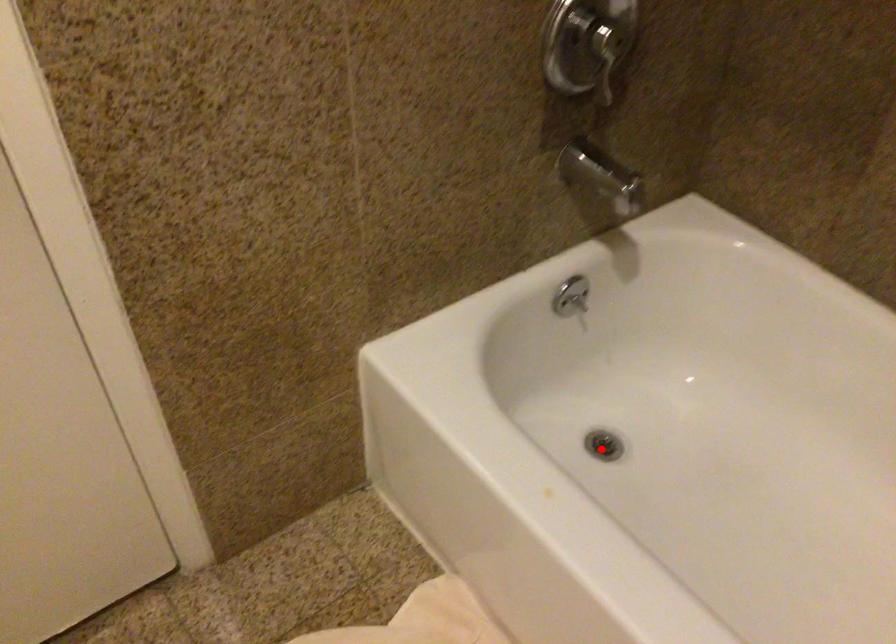
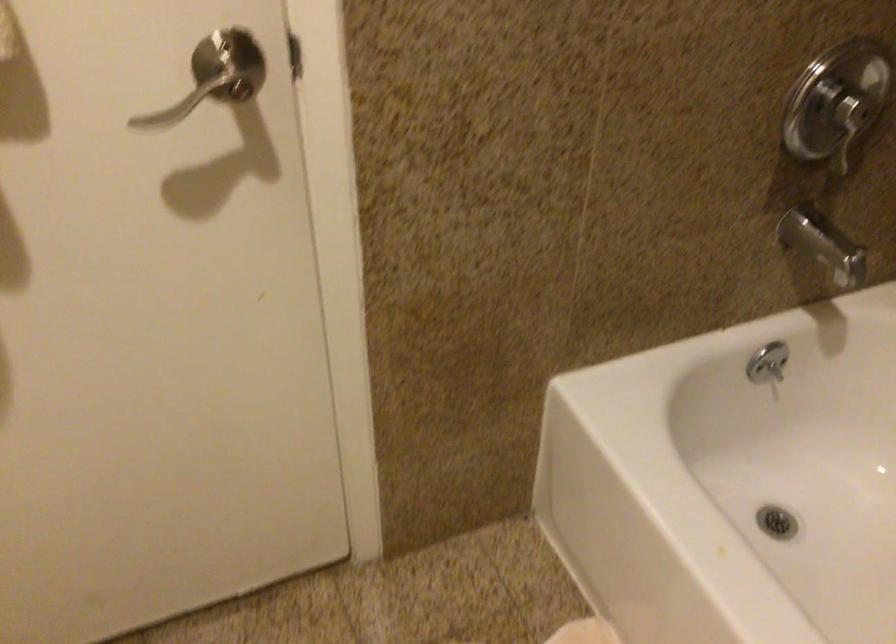
In the second image, find the point that corresponds to the highlighted location in the first image.

(776, 522)